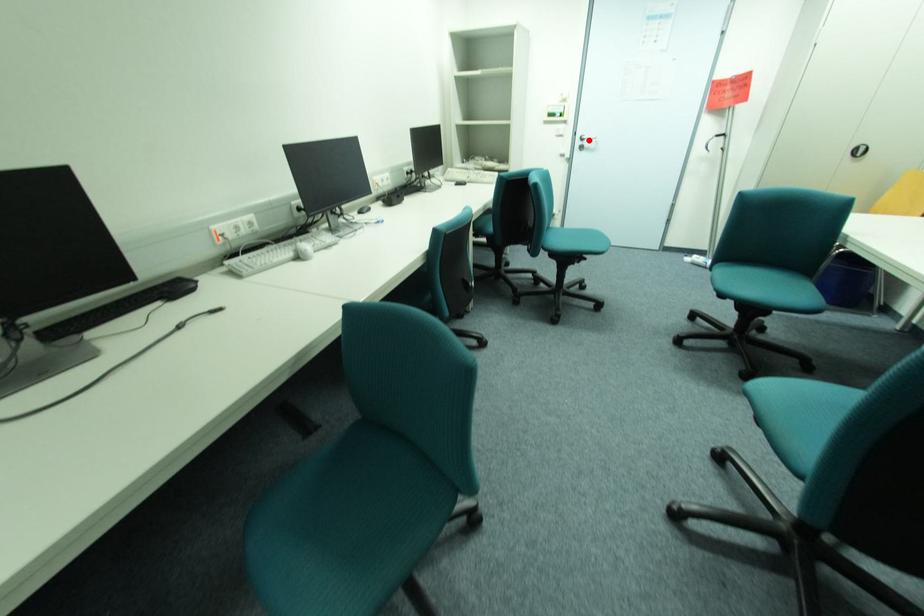
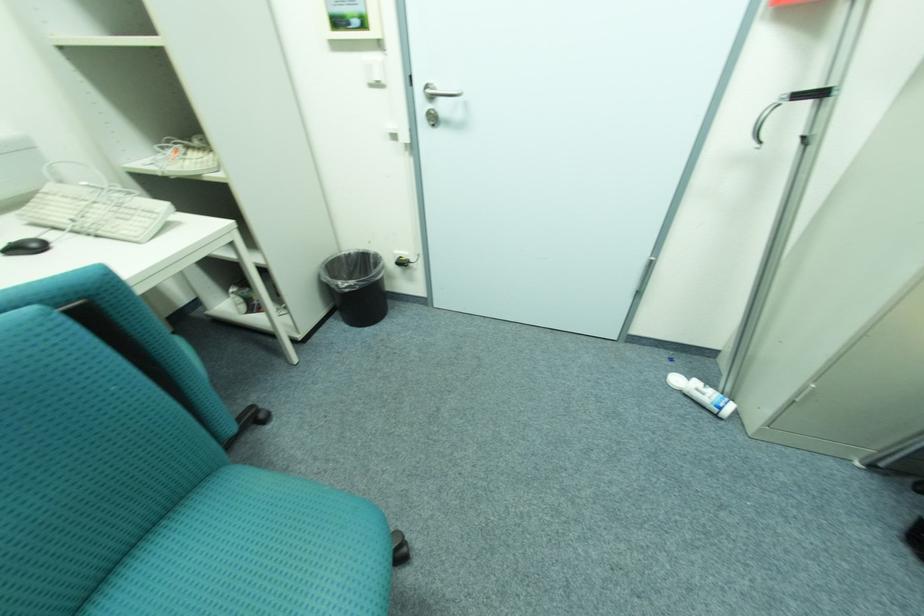
Question: I am providing you with two images of the same scene from different viewpoints. A red point is shown in image1. For the corresponding object point in image2, is it positioned nearer or farther from the camera?

Choices:
 (A) Nearer
 (B) Farther

Answer: (B)